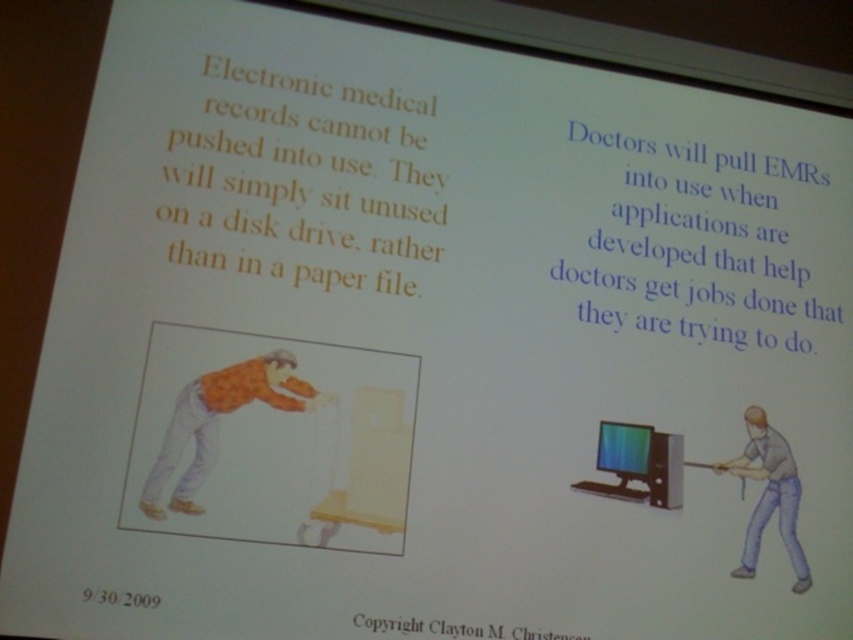
Question: Which point appears closest to the camera in this image?

Choices:
 (A) (639, 449)
 (B) (776, 456)
 (C) (263, 381)

Answer: (C)

Question: Among these objects, which one is farthest from the camera?

Choices:
 (A) orange printed shirt at lower left
 (B) matte black monitor at center

Answer: (B)

Question: Is gray matte shirt at center right above matte black monitor at center?

Choices:
 (A) yes
 (B) no

Answer: (B)

Question: Which of the following is the farthest from the observer?

Choices:
 (A) gray matte shirt at center right
 (B) orange printed shirt at lower left

Answer: (A)

Question: Where is orange printed shirt at lower left located in relation to gray matte shirt at center right in the image?

Choices:
 (A) below
 (B) above

Answer: (B)

Question: Is orange printed shirt at lower left bigger than gray matte shirt at center right?

Choices:
 (A) no
 (B) yes

Answer: (B)